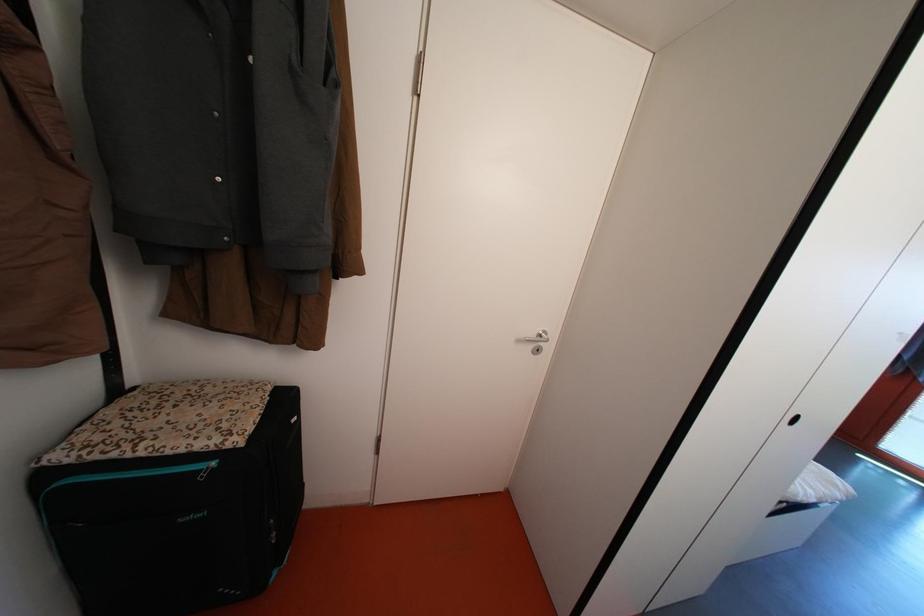
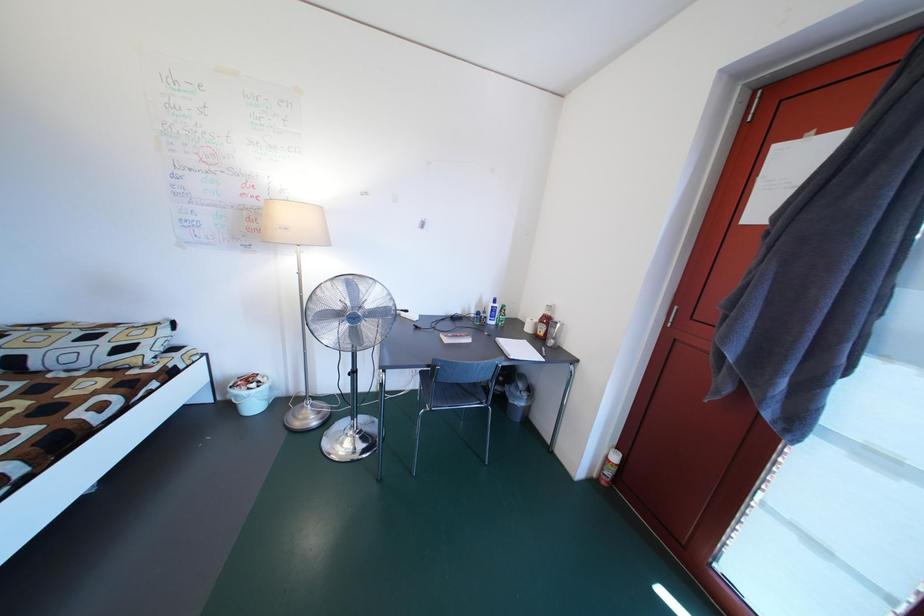
What movement of the cameraman would produce the second image?

The movement direction of the cameraman is right, forward.